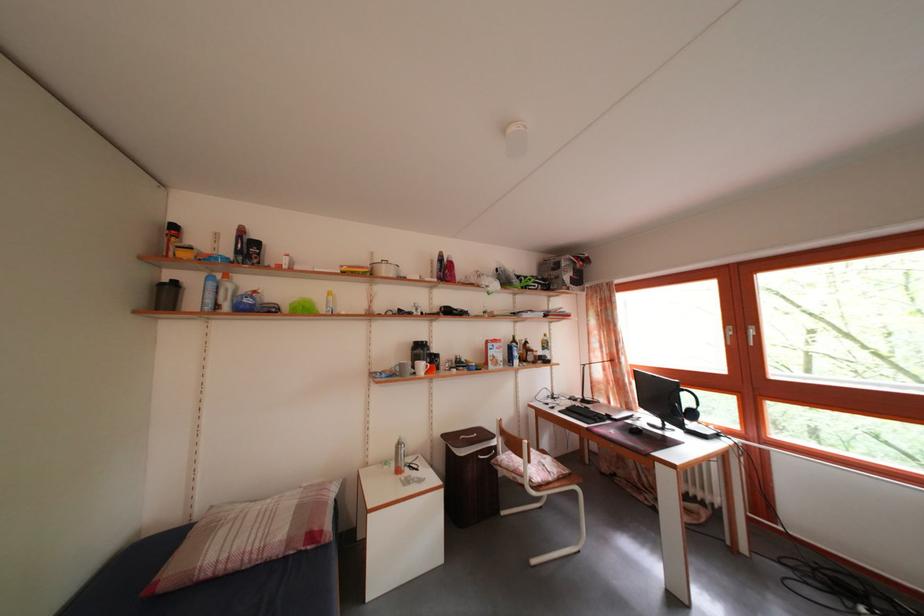
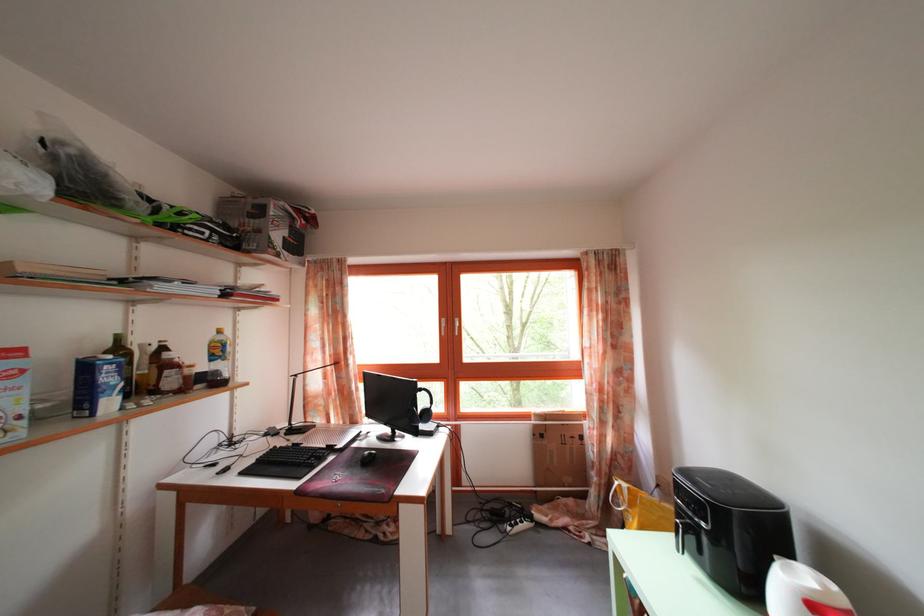
Find the pixel in the second image that matches (690,398) in the first image.

(428, 397)